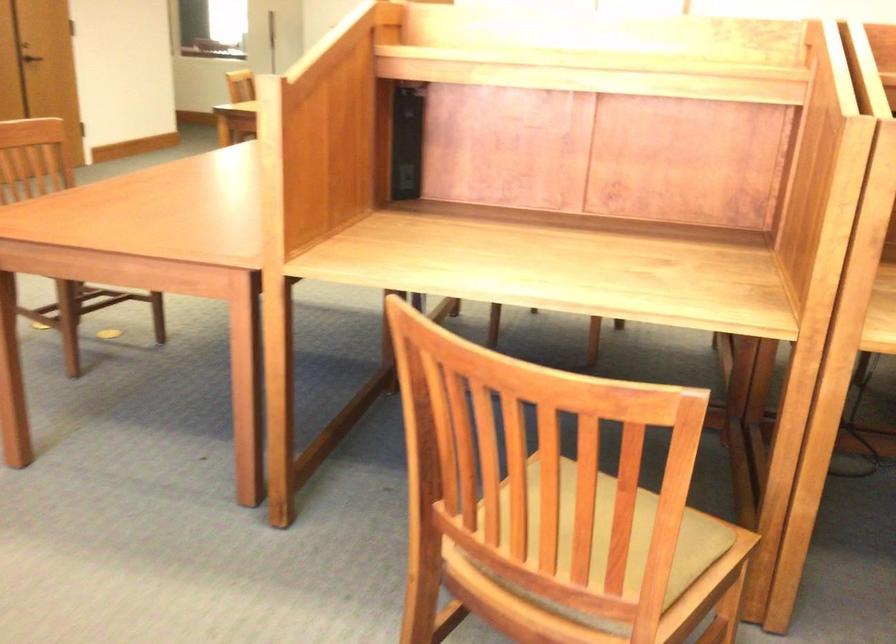
Identify the location of chair sitting surface. (651, 565).